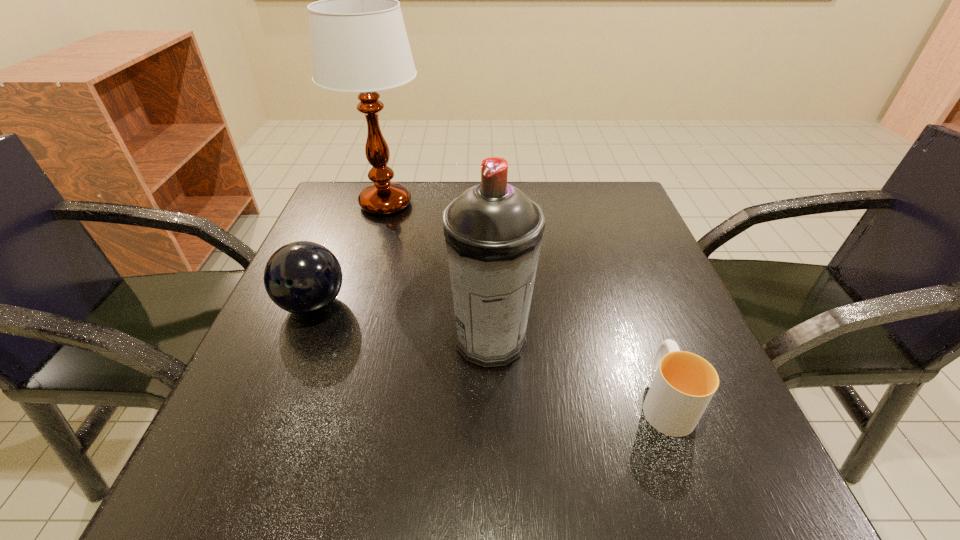
Locate an element on the screen. The image size is (960, 540). vacant region located with the handle on the side of the rightmost object is located at coordinates tap(610, 248).

This screenshot has width=960, height=540. In order to click on free space located with the handle on the side of the rightmost object in this screenshot , I will do `click(627, 296)`.

Where is `vacant space situated with the handle on the side of the rightmost object`? vacant space situated with the handle on the side of the rightmost object is located at coordinates (640, 333).

You are a GUI agent. You are given a task and a screenshot of the screen. Output one action in this format:
    pyautogui.click(x=<x>, y=<y>)
    Task: Click on the object located at the far edge
    The height and width of the screenshot is (540, 960).
    Given the screenshot: What is the action you would take?
    pyautogui.click(x=359, y=43)

Identify the location of table lamp that is positioned at the left edge. This screenshot has height=540, width=960. (359, 43).

Locate an element on the screen. The image size is (960, 540). bowling ball present at the left edge is located at coordinates (302, 277).

Where is `object positioned at the right edge`? This screenshot has width=960, height=540. object positioned at the right edge is located at coordinates (684, 383).

Where is `object present at the far left corner`? The width and height of the screenshot is (960, 540). object present at the far left corner is located at coordinates (359, 43).

What are the coordinates of `free location at the far edge of the desktop` in the screenshot? It's located at (426, 185).

This screenshot has width=960, height=540. Find the location of `vacant region at the near edge of the desktop`. vacant region at the near edge of the desktop is located at coordinates (488, 448).